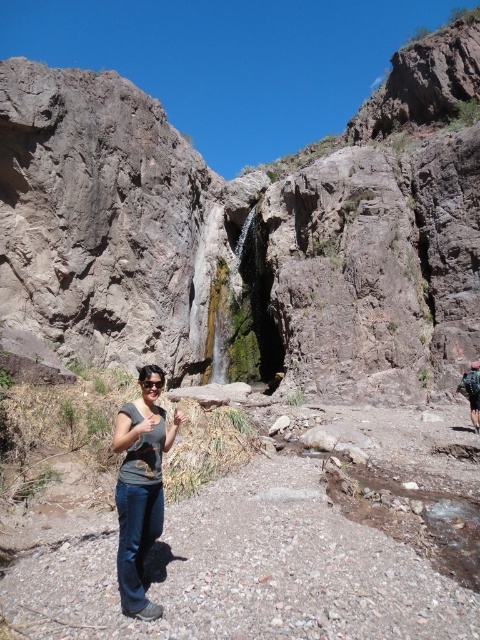
Question: Can you confirm if brown rocky canyon at center is smaller than dark blue backpack at right?

Choices:
 (A) no
 (B) yes

Answer: (A)

Question: Based on their relative distances, which object is nearer to the dark blue backpack at right?

Choices:
 (A) gray matte shirt at center
 (B) brown rocky canyon at center

Answer: (A)

Question: Which of the following is the closest to the observer?

Choices:
 (A) gray matte shirt at center
 (B) dark blue backpack at right

Answer: (A)

Question: Can you confirm if gray matte shirt at center is positioned below dark blue backpack at right?

Choices:
 (A) yes
 (B) no

Answer: (B)

Question: Which point is closer to the camera?

Choices:
 (A) dark blue backpack at right
 (B) gray matte shirt at center

Answer: (B)

Question: Can you confirm if brown rocky canyon at center is positioned above gray matte shirt at center?

Choices:
 (A) no
 (B) yes

Answer: (B)